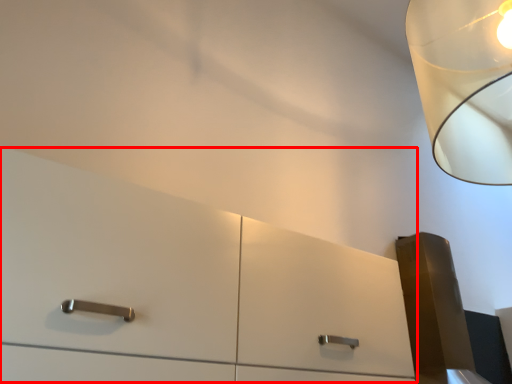
Question: From the image's perspective, what is the correct spatial positioning of dresser (annotated by the red box) in reference to lamp?

Choices:
 (A) above
 (B) below

Answer: (B)